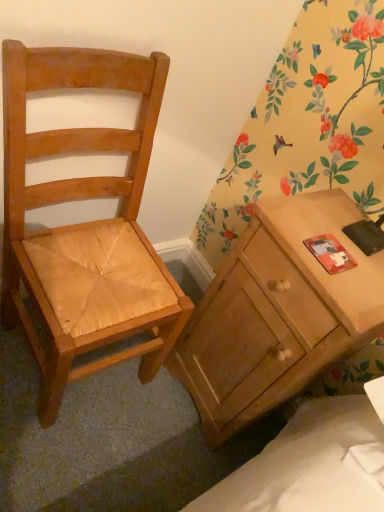
What is the approximate height of light brown wood chair at left?

light brown wood chair at left is 36.54 inches in height.

This screenshot has width=384, height=512. What are the coordinates of `light brown wood chair at left` in the screenshot? It's located at (84, 223).

Describe the element at coordinates (84, 223) in the screenshot. I see `light brown wood chair at left` at that location.

I want to click on matte wood desk at right, so click(x=277, y=314).

The height and width of the screenshot is (512, 384). Describe the element at coordinates (277, 314) in the screenshot. I see `matte wood desk at right` at that location.

Locate an element on the screen. Image resolution: width=384 pixels, height=512 pixels. light brown wood chair at left is located at coordinates (84, 223).

Visually, is matte wood desk at right positioned to the left or to the right of light brown wood chair at left?

Based on their positions, matte wood desk at right is located to the right of light brown wood chair at left.

Is matte wood desk at right further to the viewer compared to light brown wood chair at left?

Yes, matte wood desk at right is behind light brown wood chair at left.

Which is closer, (315, 198) or (35, 71)?

Clearly, point (315, 198) is more distant from the camera than point (35, 71).

From the image's perspective, is matte wood desk at right under light brown wood chair at left?

Indeed, from the image's perspective, matte wood desk at right is shown beneath light brown wood chair at left.

From a real-world perspective, between matte wood desk at right and light brown wood chair at left, who is vertically higher?

From a 3D spatial view, light brown wood chair at left is above.

Is matte wood desk at right thinner than light brown wood chair at left?

Indeed, matte wood desk at right has a lesser width compared to light brown wood chair at left.

Considering the relative sizes of matte wood desk at right and light brown wood chair at left in the image provided, is matte wood desk at right taller than light brown wood chair at left?

Incorrect, the height of matte wood desk at right is not larger of that of light brown wood chair at left.

Considering the sizes of objects matte wood desk at right and light brown wood chair at left in the image provided, who is bigger, matte wood desk at right or light brown wood chair at left?

light brown wood chair at left is bigger.

Is matte wood desk at right not within light brown wood chair at left?

Yes, matte wood desk at right is located beyond the bounds of light brown wood chair at left.

Is matte wood desk at right directly adjacent to light brown wood chair at left?

They are not placed beside each other.

Is matte wood desk at right facing away from light brown wood chair at left?

No, matte wood desk at right's orientation is not away from light brown wood chair at left.

What's the angular difference between matte wood desk at right and light brown wood chair at left's facing directions?

The facing directions of matte wood desk at right and light brown wood chair at left are 89.6 degrees apart.

In the scene shown: How distant is matte wood desk at right from light brown wood chair at left?

They are 13.35 inches apart.

Identify the location of chair that is above the matte wood desk at right (from the image's perspective). (84, 223).

Considering the relative positions of light brown wood chair at left and matte wood desk at right in the image provided, is light brown wood chair at left to the left of matte wood desk at right from the viewer's perspective?

Correct, you'll find light brown wood chair at left to the left of matte wood desk at right.

Is light brown wood chair at left positioned before matte wood desk at right?

Yes, it is in front of matte wood desk at right.

Considering the points (4, 125) and (314, 376), which point is behind, point (4, 125) or point (314, 376)?

Positioned behind is point (314, 376).

From the image's perspective, is light brown wood chair at left over matte wood desk at right?

Indeed, from the image's perspective, light brown wood chair at left is shown above matte wood desk at right.

From a real-world perspective, is light brown wood chair at left on top of matte wood desk at right?

Yes, from a real-world perspective, light brown wood chair at left is on top of matte wood desk at right.

Is light brown wood chair at left wider or thinner than matte wood desk at right?

Clearly, light brown wood chair at left has more width compared to matte wood desk at right.

Who is taller, light brown wood chair at left or matte wood desk at right?

Standing taller between the two is light brown wood chair at left.

Does light brown wood chair at left have a larger size compared to matte wood desk at right?

Yes.

Is light brown wood chair at left not inside matte wood desk at right?

That's correct, light brown wood chair at left is outside of matte wood desk at right.

Is light brown wood chair at left not near matte wood desk at right?

That's not correct — light brown wood chair at left is a little close to matte wood desk at right.

Does light brown wood chair at left turn towards matte wood desk at right?

No, light brown wood chair at left is not aimed at matte wood desk at right.

From the picture: What's the angular difference between light brown wood chair at left and matte wood desk at right's facing directions?

The facing directions of light brown wood chair at left and matte wood desk at right are 89.6 degrees apart.

The width and height of the screenshot is (384, 512). I want to click on desk lying on the right of light brown wood chair at left, so click(277, 314).

At what (x,y) coordinates should I click in order to perform the action: click on chair lying in front of the matte wood desk at right. Please return your answer as a coordinate pair (x, y). This screenshot has width=384, height=512. Looking at the image, I should click on (84, 223).

Where is `chair on the left of matte wood desk at right`? chair on the left of matte wood desk at right is located at coordinates (84, 223).